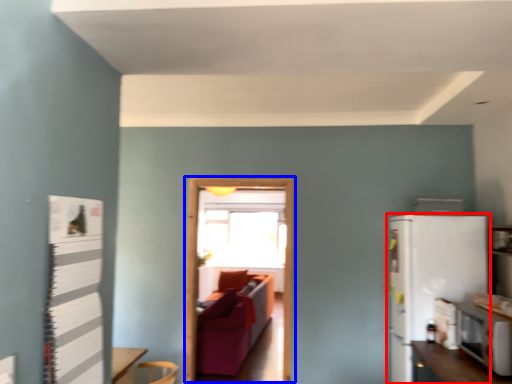
Question: Among these objects, which one is nearest to the camera, refrigerator (highlighted by a red box) or glass door (highlighted by a blue box)?

Choices:
 (A) refrigerator
 (B) glass door

Answer: (A)